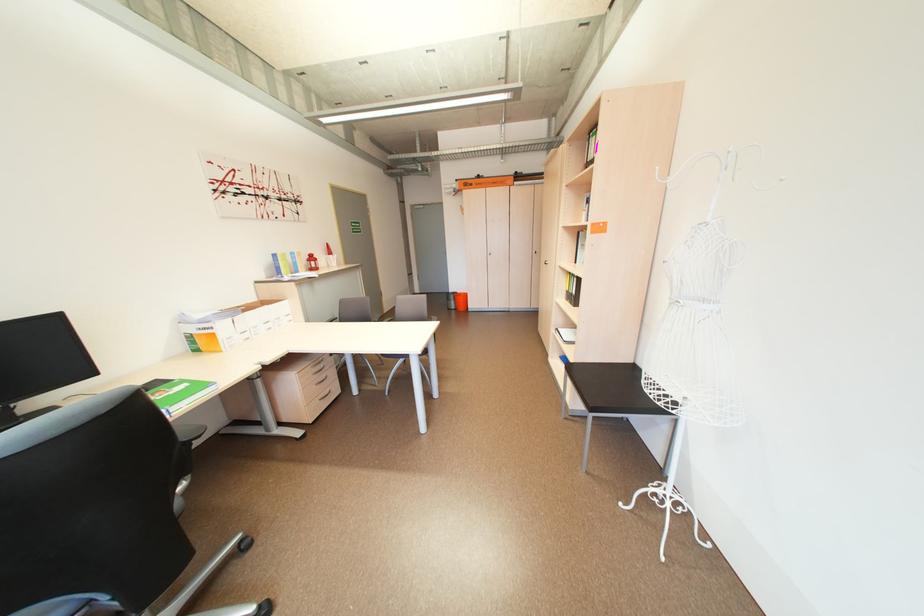
Where would you turn the gray door handle? Please return your answer as a coordinate pair (x, y).

(529, 265)